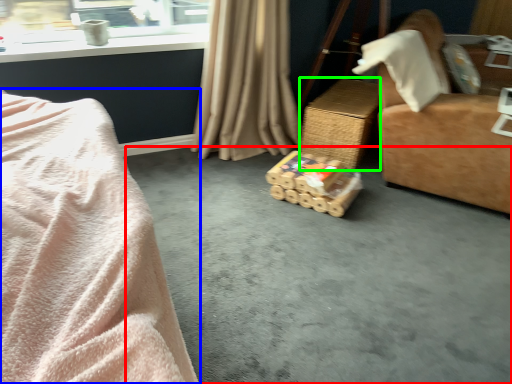
Question: Based on their relative distances, which object is nearer to concrete (highlighted by a red box)? Choose from bed (highlighted by a blue box) and table (highlighted by a green box).

Choices:
 (A) bed
 (B) table

Answer: (B)